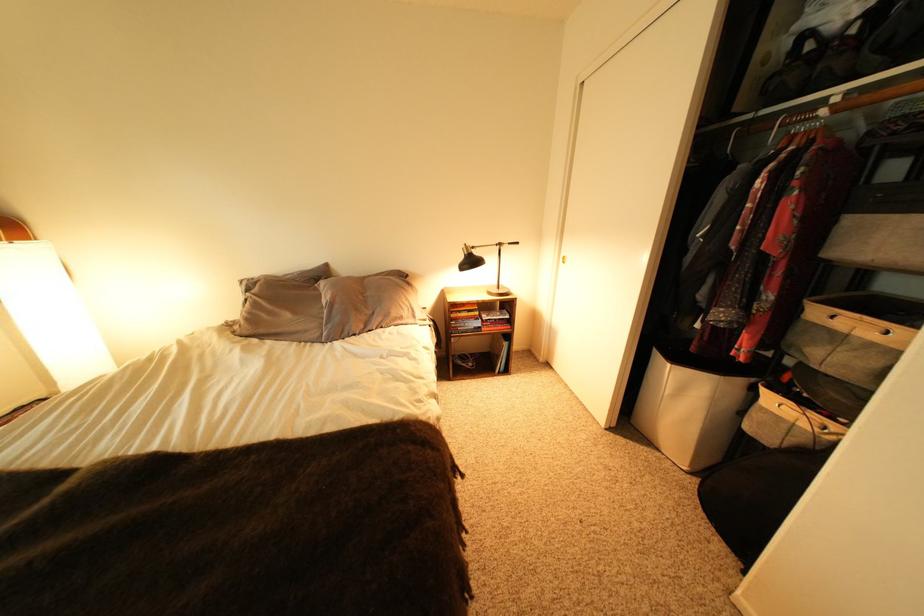
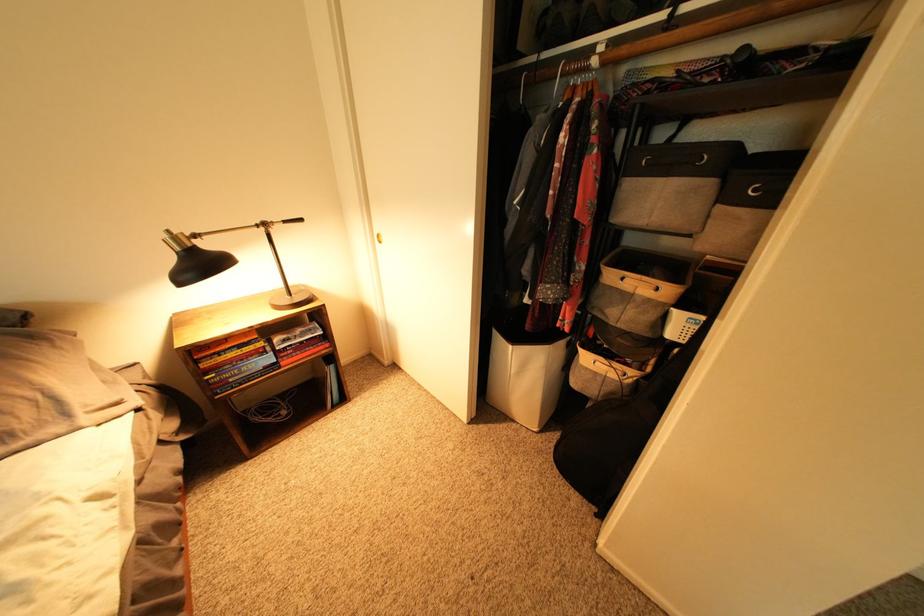
Question: The camera is either moving clockwise (left) or counter-clockwise (right) around the object. The first image is from the beginning of the video and the second image is from the end. Is the camera moving left or right when shooting the video?

Choices:
 (A) Left
 (B) Right

Answer: (A)